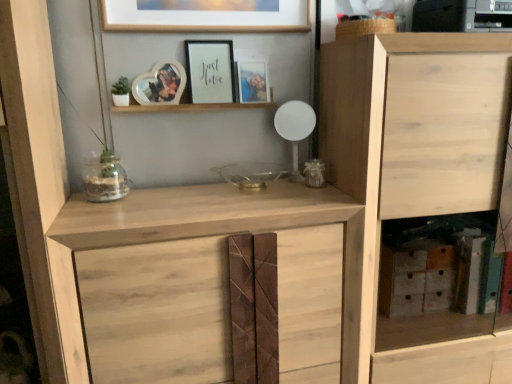
Locate an element on the screen. Image resolution: width=512 pixels, height=384 pixels. wooden heart-shaped photo frame at upper center, the 1th picture frame from the left is located at coordinates (160, 84).

Describe the element at coordinates (210, 71) in the screenshot. This screenshot has width=512, height=384. I see `matte white frame at upper center, which is counted as the 2th picture frame, starting from the left` at that location.

Image resolution: width=512 pixels, height=384 pixels. What do you see at coordinates (223, 227) in the screenshot? I see `natural wood cupboard at center, the second cupboard positioned from the right` at bounding box center [223, 227].

This screenshot has height=384, width=512. I want to click on clear glass vase at center, so click(105, 179).

In order to click on matte wooden photo frame at upper center, acting as the 3th picture frame starting from the left in this screenshot , I will do `click(252, 81)`.

The width and height of the screenshot is (512, 384). I want to click on the 1st cupboard counting from the right side of the wooden heart-shaped photo frame at upper center, the 1th picture frame from the left, so click(x=223, y=227).

Are wooden heart-shaped photo frame at upper center, which ranks as the third picture frame in right-to-left order, and natural wood cupboard at center, the second cupboard positioned from the right, beside each other?

There is a gap between wooden heart-shaped photo frame at upper center, which ranks as the third picture frame in right-to-left order, and natural wood cupboard at center, the second cupboard positioned from the right.

What's the angular difference between wooden heart-shaped photo frame at upper center, which ranks as the third picture frame in right-to-left order, and natural wood cupboard at center, positioned as the first cupboard in left-to-right order,'s facing directions?

0.671 degrees separate the facing orientations of wooden heart-shaped photo frame at upper center, which ranks as the third picture frame in right-to-left order, and natural wood cupboard at center, positioned as the first cupboard in left-to-right order.

Can you confirm if wooden heart-shaped photo frame at upper center, which ranks as the third picture frame in right-to-left order, is bigger than natural wood cupboard at center, the second cupboard positioned from the right?

Incorrect, wooden heart-shaped photo frame at upper center, which ranks as the third picture frame in right-to-left order, is not larger than natural wood cupboard at center, the second cupboard positioned from the right.

Considering the relative sizes of matte wooden photo frame at upper center, arranged as the first picture frame when viewed from the right, and natural wood cupboard at center, positioned as the first cupboard in left-to-right order, in the image provided, is matte wooden photo frame at upper center, arranged as the first picture frame when viewed from the right, wider than natural wood cupboard at center, positioned as the first cupboard in left-to-right order,?

No, matte wooden photo frame at upper center, arranged as the first picture frame when viewed from the right, is not wider than natural wood cupboard at center, positioned as the first cupboard in left-to-right order.

How much distance is there between matte wooden photo frame at upper center, acting as the 3th picture frame starting from the left, and natural wood cupboard at center, the second cupboard positioned from the right?

matte wooden photo frame at upper center, acting as the 3th picture frame starting from the left, is 23.18 inches from natural wood cupboard at center, the second cupboard positioned from the right.

Considering the positions of point (266, 94) and point (343, 376), is point (266, 94) closer or farther from the camera than point (343, 376)?

Point (266, 94) is farther from the camera than point (343, 376).

You are a GUI agent. You are given a task and a screenshot of the screen. Output one action in this format:
    pyautogui.click(x=<x>, y=<y>)
    Task: Click on the cupboard that appears on the left of matte wooden photo frame at upper center, arranged as the first picture frame when viewed from the right
    Image resolution: width=512 pixels, height=384 pixels.
    Given the screenshot: What is the action you would take?
    pyautogui.click(x=223, y=227)

From the image's perspective, is natural wood cupboard at center, positioned as the first cupboard in left-to-right order, located above or below matte wooden photo frame at upper center, acting as the 3th picture frame starting from the left?

Clearly, from the image's perspective, natural wood cupboard at center, positioned as the first cupboard in left-to-right order, is below matte wooden photo frame at upper center, acting as the 3th picture frame starting from the left.

Is natural wood cupboard at center, positioned as the first cupboard in left-to-right order, facing towards matte wooden photo frame at upper center, acting as the 3th picture frame starting from the left?

No, natural wood cupboard at center, positioned as the first cupboard in left-to-right order, is not facing towards matte wooden photo frame at upper center, acting as the 3th picture frame starting from the left.

Between natural wood cupboard at center, positioned as the first cupboard in left-to-right order, and matte wooden photo frame at upper center, arranged as the first picture frame when viewed from the right, which one is positioned behind?

Positioned behind is matte wooden photo frame at upper center, arranged as the first picture frame when viewed from the right.

Is natural wood cupboard at center, the second cupboard positioned from the right, next to matte wooden photo frame at upper center, acting as the 3th picture frame starting from the left, and touching it?

natural wood cupboard at center, the second cupboard positioned from the right, is not next to matte wooden photo frame at upper center, acting as the 3th picture frame starting from the left, and they're not touching.

Is clear glass vase at center further to camera compared to matte white frame at upper center, the second picture frame when ordered from right to left?

No, the depth of clear glass vase at center is less than that of matte white frame at upper center, the second picture frame when ordered from right to left.

Is clear glass vase at center bigger than matte white frame at upper center, the second picture frame when ordered from right to left?

Correct, clear glass vase at center is larger in size than matte white frame at upper center, the second picture frame when ordered from right to left.

Is clear glass vase at center next to matte white frame at upper center, the second picture frame when ordered from right to left, and touching it?

They are not placed beside each other.

From a real-world perspective, does clear glass vase at center stand above matte white frame at upper center, the second picture frame when ordered from right to left?

Incorrect, from a real-world perspective, clear glass vase at center is lower than matte white frame at upper center, the second picture frame when ordered from right to left.

From a real-world perspective, who is located lower, wooden heart-shaped photo frame at upper center, which ranks as the third picture frame in right-to-left order, or matte wooden photo frame at upper center, acting as the 3th picture frame starting from the left?

matte wooden photo frame at upper center, acting as the 3th picture frame starting from the left.

From the image's perspective, between wooden heart-shaped photo frame at upper center, which ranks as the third picture frame in right-to-left order, and matte wooden photo frame at upper center, arranged as the first picture frame when viewed from the right, who is located below?

wooden heart-shaped photo frame at upper center, which ranks as the third picture frame in right-to-left order.

Is wooden heart-shaped photo frame at upper center, the 1th picture frame from the left, oriented towards matte wooden photo frame at upper center, acting as the 3th picture frame starting from the left?

No, wooden heart-shaped photo frame at upper center, the 1th picture frame from the left, is not facing towards matte wooden photo frame at upper center, acting as the 3th picture frame starting from the left.

From a real-world perspective, which object rests below the other?

natural wood cabinet at right, which is the first cupboard from right to left, from a real-world perspective.

Is matte white frame at upper center, which is counted as the 2th picture frame, starting from the left, oriented towards natural wood cabinet at right, which is the first cupboard from right to left?

No, matte white frame at upper center, which is counted as the 2th picture frame, starting from the left, is not oriented towards natural wood cabinet at right, which is the first cupboard from right to left.

Would you say matte white frame at upper center, which is counted as the 2th picture frame, starting from the left, is to the left or to the right of natural wood cabinet at right, which is the first cupboard from right to left, in the picture?

Based on their positions, matte white frame at upper center, which is counted as the 2th picture frame, starting from the left, is located to the left of natural wood cabinet at right, which is the first cupboard from right to left.

Is matte white frame at upper center, which is counted as the 2th picture frame, starting from the left, far away from natural wood cabinet at right, the second cupboard in the left-to-right sequence?

Actually, matte white frame at upper center, which is counted as the 2th picture frame, starting from the left, and natural wood cabinet at right, the second cupboard in the left-to-right sequence, are a little close together.

Considering the sizes of objects natural wood cupboard at center, the second cupboard positioned from the right, and clear glass vase at center in the image provided, who is thinner, natural wood cupboard at center, the second cupboard positioned from the right, or clear glass vase at center?

With smaller width is clear glass vase at center.

Between natural wood cupboard at center, the second cupboard positioned from the right, and clear glass vase at center, which one is positioned in front?

Positioned in front is natural wood cupboard at center, the second cupboard positioned from the right.

From a real-world perspective, is natural wood cupboard at center, the second cupboard positioned from the right, positioned above or below clear glass vase at center?

natural wood cupboard at center, the second cupboard positioned from the right, is below clear glass vase at center.

Can you confirm if natural wood cupboard at center, the second cupboard positioned from the right, is shorter than clear glass vase at center?

In fact, natural wood cupboard at center, the second cupboard positioned from the right, may be taller than clear glass vase at center.

From the wooden heart-shaped photo frame at upper center, which ranks as the third picture frame in right-to-left order, count 2nd cupboards forward and point to it. Please provide its 2D coordinates.

[(223, 227)]

There is a natural wood cupboard at center, positioned as the first cupboard in left-to-right order. Where is `the 1st picture frame above it (from a real-world perspective)`? The height and width of the screenshot is (384, 512). the 1st picture frame above it (from a real-world perspective) is located at coordinates (252, 81).

Considering their positions, is natural wood cabinet at right, which is the first cupboard from right to left, positioned closer to wooden heart-shaped photo frame at upper center, which ranks as the third picture frame in right-to-left order, than matte wooden photo frame at upper center, acting as the 3th picture frame starting from the left?

The object closer to wooden heart-shaped photo frame at upper center, which ranks as the third picture frame in right-to-left order, is matte wooden photo frame at upper center, acting as the 3th picture frame starting from the left.

When comparing their distances from wooden heart-shaped photo frame at upper center, the 1th picture frame from the left, does matte white frame at upper center, the second picture frame when ordered from right to left, or clear glass vase at center seem closer?

Based on the image, matte white frame at upper center, the second picture frame when ordered from right to left, appears to be nearer to wooden heart-shaped photo frame at upper center, the 1th picture frame from the left.

Based on their spatial positions, is matte white frame at upper center, the second picture frame when ordered from right to left, or matte wooden photo frame at upper center, acting as the 3th picture frame starting from the left, further from clear glass vase at center?

matte wooden photo frame at upper center, acting as the 3th picture frame starting from the left, is positioned further to the anchor clear glass vase at center.

Looking at the image, which one is located closer to natural wood cabinet at right, the second cupboard in the left-to-right sequence, natural wood cupboard at center, the second cupboard positioned from the right, or wooden heart-shaped photo frame at upper center, which ranks as the third picture frame in right-to-left order?

natural wood cupboard at center, the second cupboard positioned from the right, lies closer to natural wood cabinet at right, the second cupboard in the left-to-right sequence, than the other object.

From the picture: Which object lies nearer to the anchor point matte wooden photo frame at upper center, acting as the 3th picture frame starting from the left, matte white frame at upper center, the second picture frame when ordered from right to left, or natural wood cabinet at right, the second cupboard in the left-to-right sequence?

matte white frame at upper center, the second picture frame when ordered from right to left, is positioned closer to the anchor matte wooden photo frame at upper center, acting as the 3th picture frame starting from the left.

Looking at this image, when comparing their distances from wooden heart-shaped photo frame at upper center, which ranks as the third picture frame in right-to-left order, does matte white frame at upper center, which is counted as the 2th picture frame, starting from the left, or matte wooden photo frame at upper center, arranged as the first picture frame when viewed from the right, seem further?

Based on the image, matte wooden photo frame at upper center, arranged as the first picture frame when viewed from the right, appears to be further to wooden heart-shaped photo frame at upper center, which ranks as the third picture frame in right-to-left order.

Looking at the image, which one is located closer to natural wood cupboard at center, the second cupboard positioned from the right, matte white frame at upper center, the second picture frame when ordered from right to left, or clear glass vase at center?

The object closer to natural wood cupboard at center, the second cupboard positioned from the right, is clear glass vase at center.

From the image, which object appears to be nearer to matte wooden photo frame at upper center, arranged as the first picture frame when viewed from the right, natural wood cupboard at center, the second cupboard positioned from the right, or clear glass vase at center?

clear glass vase at center lies closer to matte wooden photo frame at upper center, arranged as the first picture frame when viewed from the right, than the other object.

Locate an element on the screen. picture frame between matte white frame at upper center, the second picture frame when ordered from right to left, and natural wood cabinet at right, the second cupboard in the left-to-right sequence is located at coordinates (252, 81).

In order to click on cupboard between matte white frame at upper center, which is counted as the 2th picture frame, starting from the left, and natural wood cabinet at right, which is the first cupboard from right to left in this screenshot , I will do `click(223, 227)`.

You are a GUI agent. You are given a task and a screenshot of the screen. Output one action in this format:
    pyautogui.click(x=<x>, y=<y>)
    Task: Click on the cupboard located between wooden heart-shaped photo frame at upper center, which ranks as the third picture frame in right-to-left order, and natural wood cabinet at right, the second cupboard in the left-to-right sequence, in the left-right direction
    
    Given the screenshot: What is the action you would take?
    pyautogui.click(x=223, y=227)

Locate an element on the screen. The height and width of the screenshot is (384, 512). picture frame between natural wood cupboard at center, positioned as the first cupboard in left-to-right order, and natural wood cabinet at right, the second cupboard in the left-to-right sequence, in the horizontal direction is located at coordinates (252, 81).